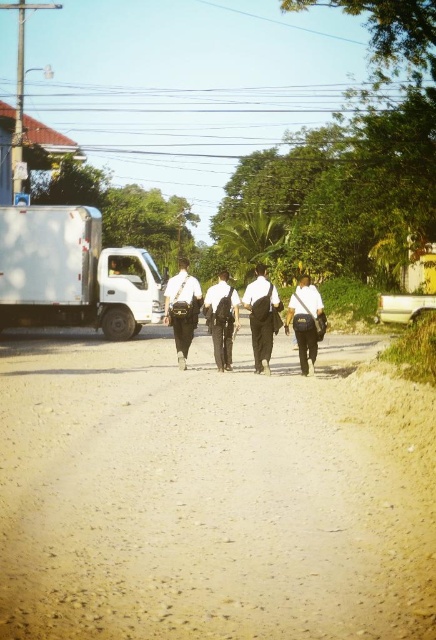
You are a photographer trying to capture a clear photo of the dark gray uniform at center and the matte black bag at center. Which object should you zoom in on to ensure it takes up more space in your photo?

The dark gray uniform at center is bigger than the matte black bag at center, so you should zoom in on the dark gray uniform at center to ensure it takes up more space in your photo.

You are one of the individuals walking along the dirt road. You want to hand a document to the person in front of you. Since you are carrying the black leather bag at center, which is to the left of the dark gray uniform at center, should you move to your right or left to pass the document without obstructing the path?

Since the black leather bag at center is to the left of the dark gray uniform at center, you should move to your right to pass the document without obstructing the path. This way, you can reach the person in front who is to your left side, ensuring a smooth handover while maintaining your position in the line.

You are a photographer standing at the starting point of the dirt road. You need to capture a photo of the dark gray uniform at center and the matte black bag at center. According to the scene description, which object is located to the left of the other?

The dark gray uniform at center is positioned on the left side of matte black bag at center.